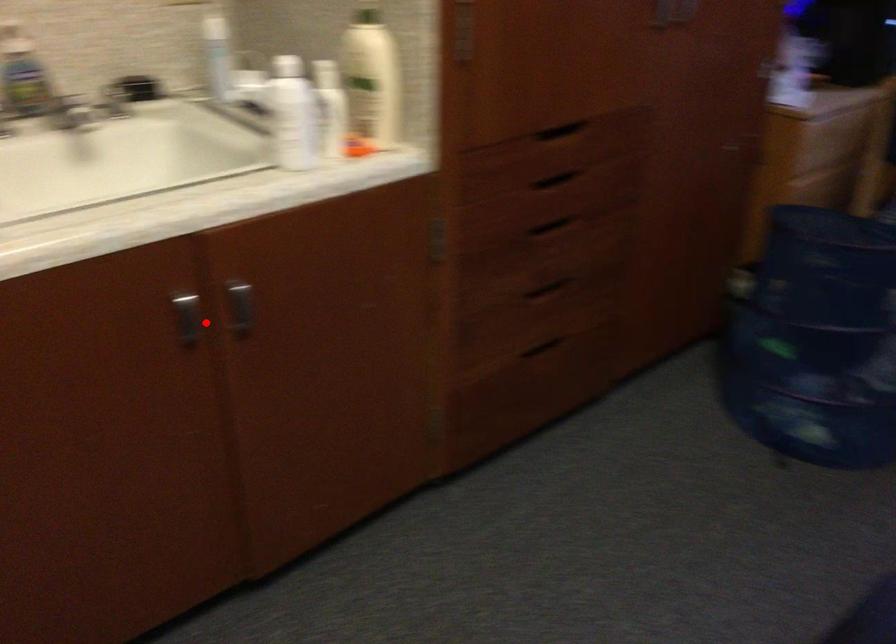
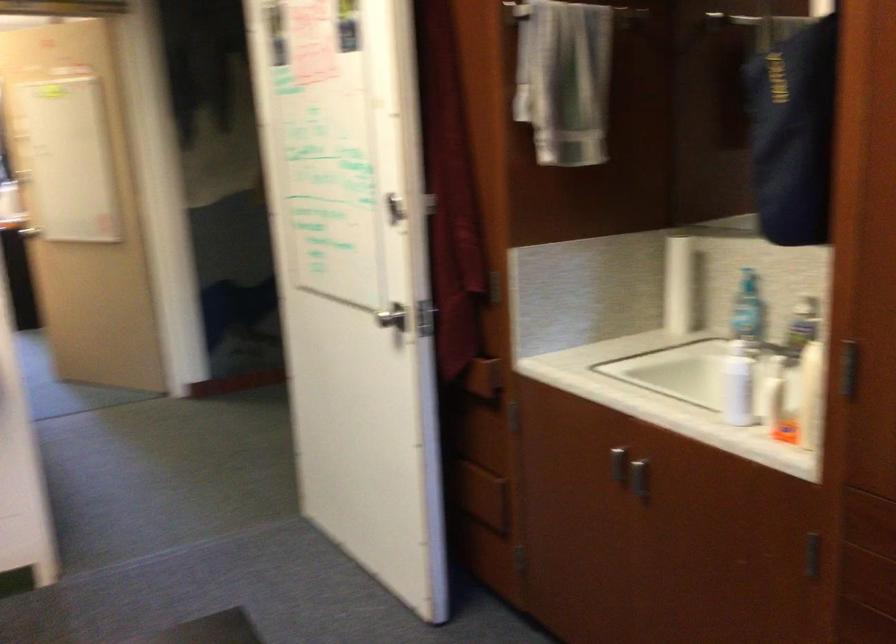
The point at the highlighted location is marked in the first image. Where is the corresponding point in the second image?

(634, 477)